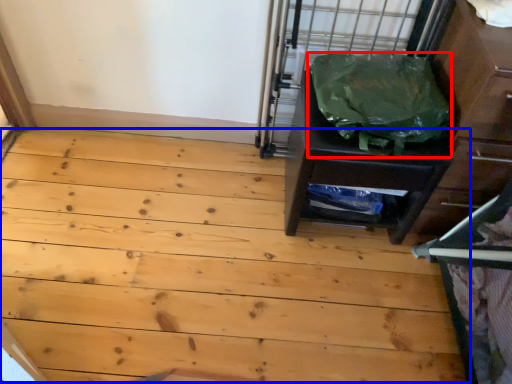
Question: Which object is closer to the camera taking this photo, garbage (highlighted by a red box) or plywood (highlighted by a blue box)?

Choices:
 (A) garbage
 (B) plywood

Answer: (A)